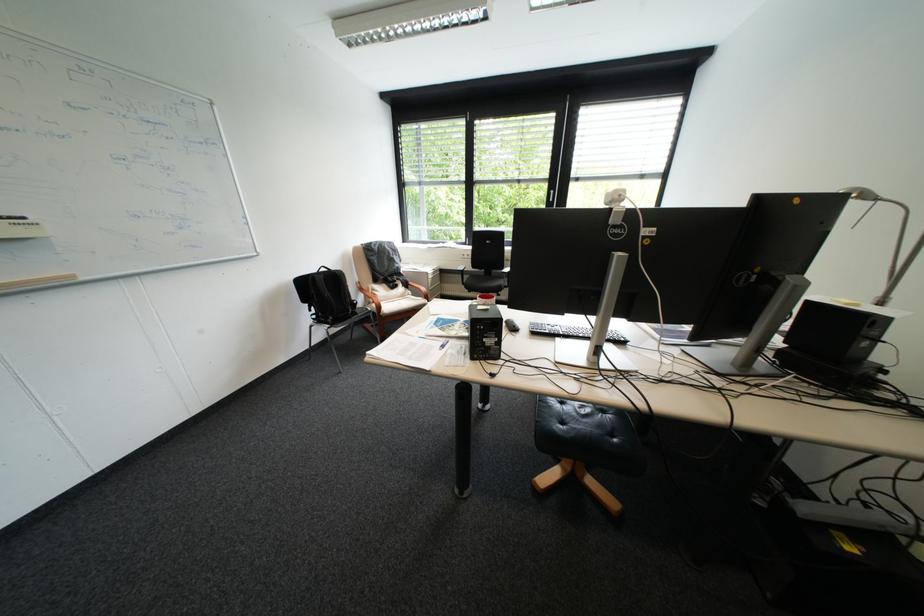
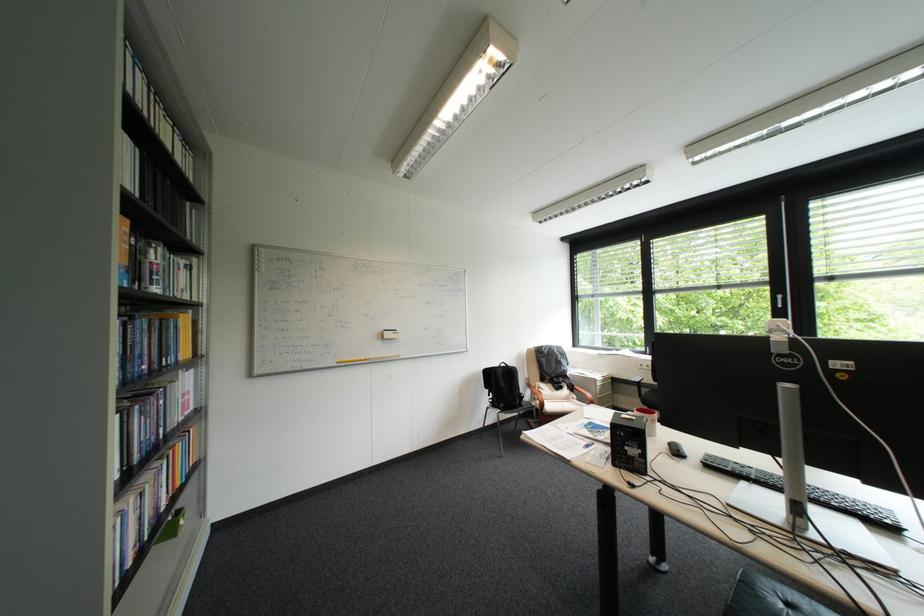
Where in the second image is the point corresponding to pixel 492 297 from the first image?

(650, 411)